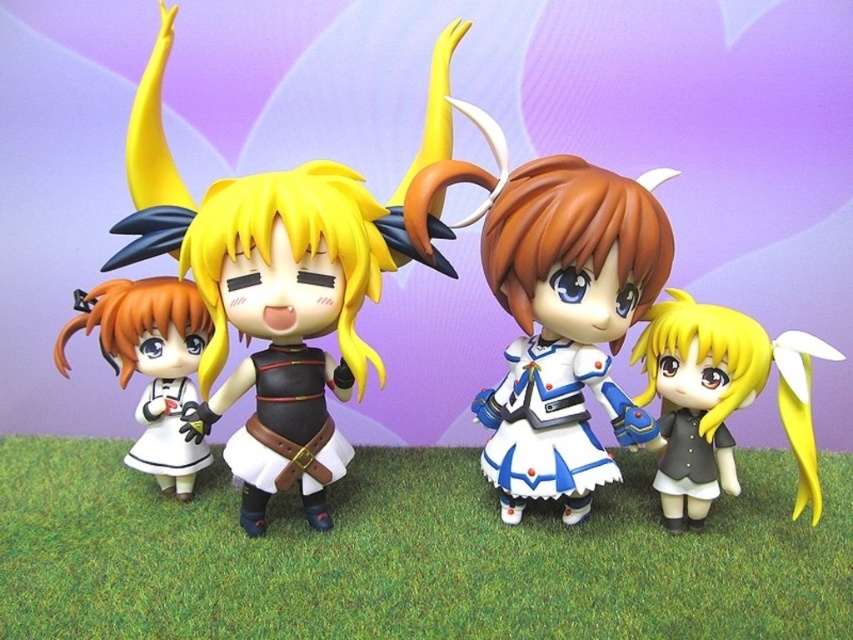
You are holding a camera and want to take a photo of the matte black doll at center. The camera requires a minimum distance of 36 inches to focus properly. Will you be able to take a clear photo from your current position?

The matte black doll at center and camera are 36.34 inches apart, which is slightly more than the required 36 inches. Therefore, you can take a clear photo from your current position.

You are a toy organizer who needs to place a new 15 inch tall accessory between the matte black doll at center and the matte black dress at center. Will there be enough space?

The distance between the matte black doll at center and the matte black dress at center is 17.53 inches, so yes, the 15 inch accessory can fit between them since it is shorter than the available space.

You are standing at the point marked as point [577,572] and want to reach the door located at the opposite side of the room. The shortest path requires moving straight ahead. Is the distance from your current position to the door sufficient for you to comfortably walk through without needing to adjust your path? Please consider the average adult height when answering.

The distance from point [577,572] to the viewer is 97.46 centimeters. Since the average adult requires about 70 centimeters of space to comfortably walk, the available space is sufficient and you can proceed without adjustments.